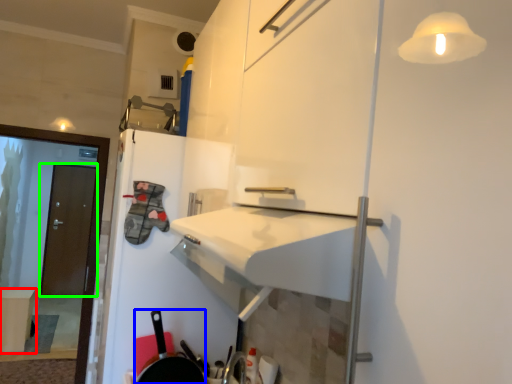
Question: Considering the real-world distances, which object is closest to table (highlighted by a red box)? frying pan (highlighted by a blue box) or door (highlighted by a green box).

Choices:
 (A) frying pan
 (B) door

Answer: (B)